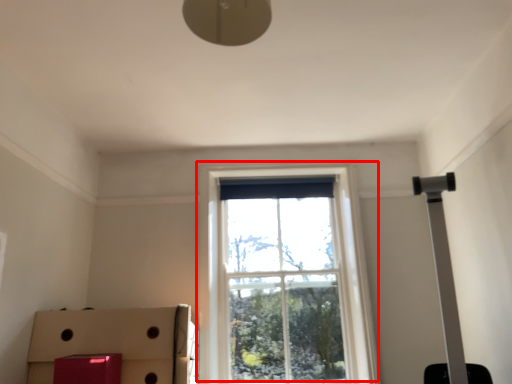
Question: From the image's perspective, what is the correct spatial relationship of window (annotated by the red box) in relation to cardboard box?

Choices:
 (A) above
 (B) below

Answer: (A)